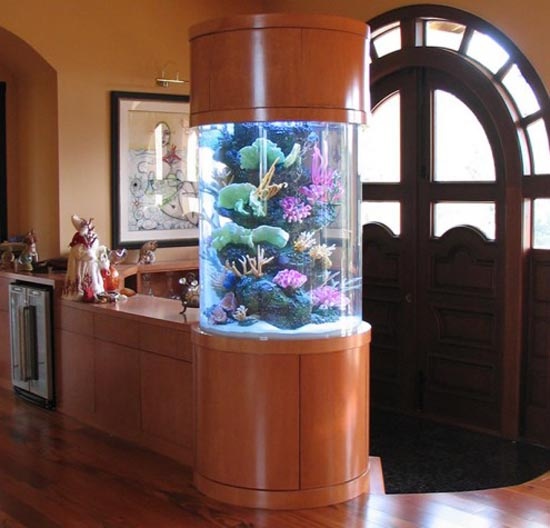
In order to click on portrait in this screenshot , I will do `click(163, 162)`.